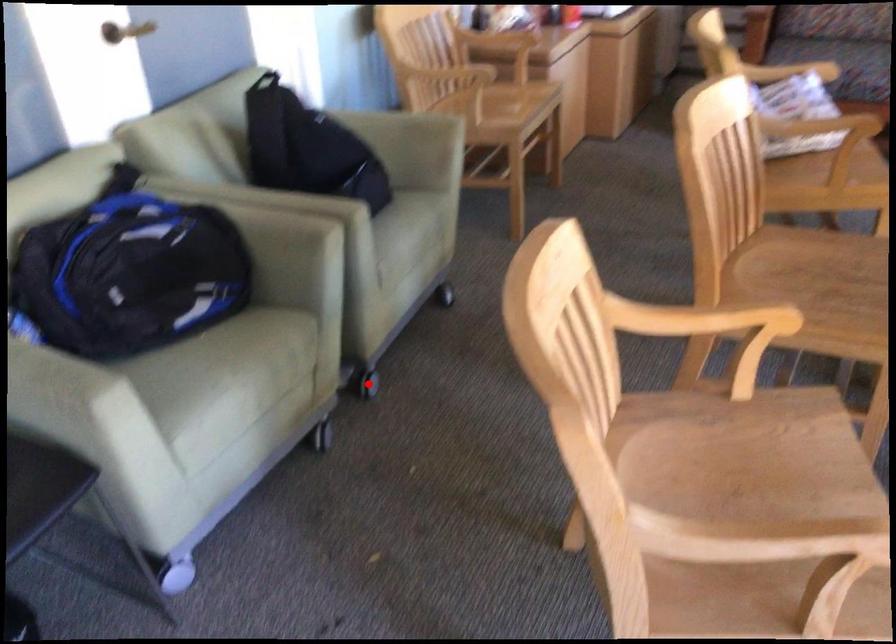
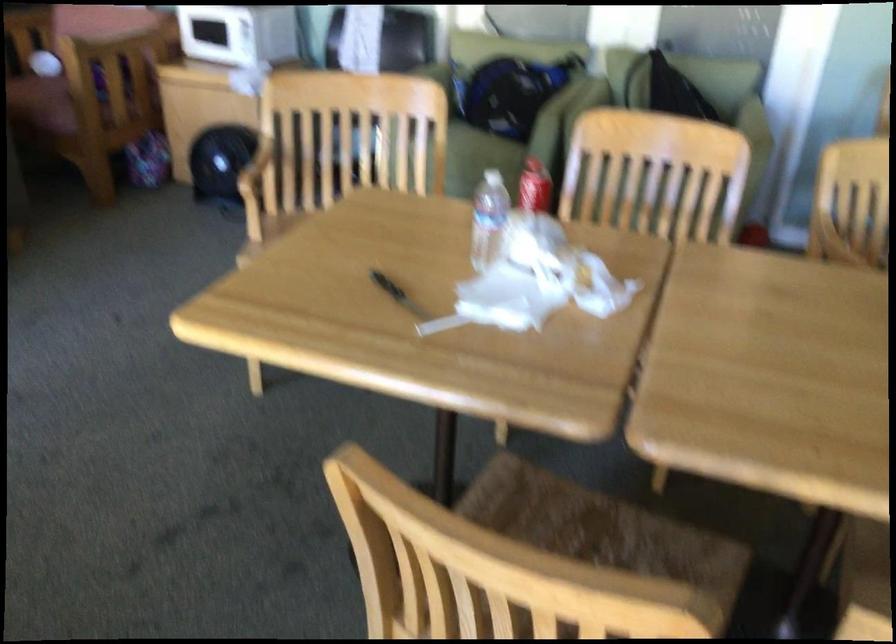
Question: I am providing you with two images of the same scene from different viewpoints. A red point is marked on the first image. Can you still see the location of the red point in image 2?

Choices:
 (A) Yes
 (B) No

Answer: (B)